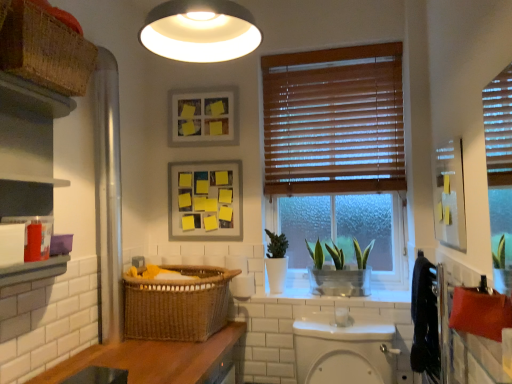
Question: From a real-world perspective, is woven brown basket at upper left, the 2th basket from the right, physically located above or below white glossy toilet bowl at center?

Choices:
 (A) below
 (B) above

Answer: (B)

Question: Considering the positions of woven brown basket at upper left, the 2th basket in the back-to-front sequence, and white glossy toilet bowl at center in the image, is woven brown basket at upper left, the 2th basket in the back-to-front sequence, bigger or smaller than white glossy toilet bowl at center?

Choices:
 (A) small
 (B) big

Answer: (A)

Question: Considering the real-world distances, which object is farthest from the woven brown basket at lower left, the 2th basket from the front?

Choices:
 (A) black fabric towel at right
 (B) green leafy plant in metallic pot at center
 (C) matte wooden picture frame at upper center, acting as the first picture frame starting from the top
 (D) white glossy toilet bowl at center
 (E) wooden blinds at center

Answer: (A)

Question: Considering the real-world distances, which object is closest to the wooden blinds at center?

Choices:
 (A) matte black cabinet at left
 (B) woven brown basket at upper left, marked as the first basket in a left-to-right arrangement
 (C) metallic silver medicine cabinet at upper right
 (D) matte wooden picture frame at upper center, acting as the first picture frame starting from the top
 (E) black fabric towel at right

Answer: (D)